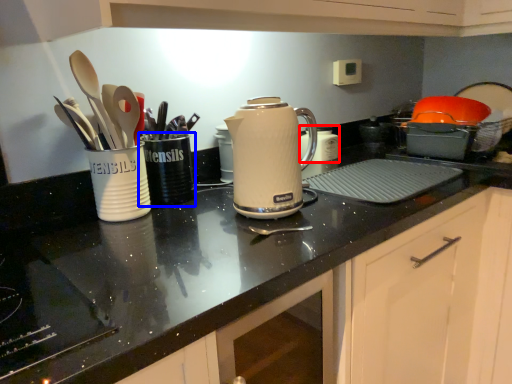
Question: Which object appears farthest to the camera in this image, appliance (highlighted by a red box) or tableware (highlighted by a blue box)?

Choices:
 (A) appliance
 (B) tableware

Answer: (A)